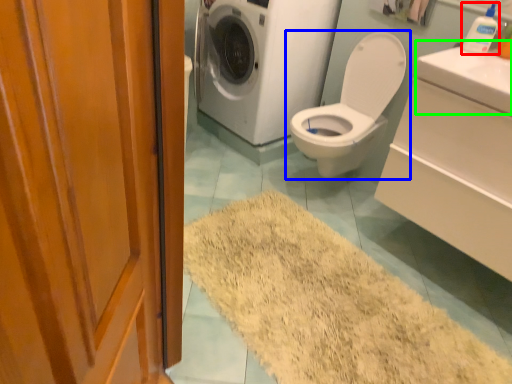
Question: Based on their relative distances, which object is nearer to toiletry (highlighted by a red box)? Choose from toilet (highlighted by a blue box) and counter top (highlighted by a green box).

Choices:
 (A) toilet
 (B) counter top

Answer: (B)